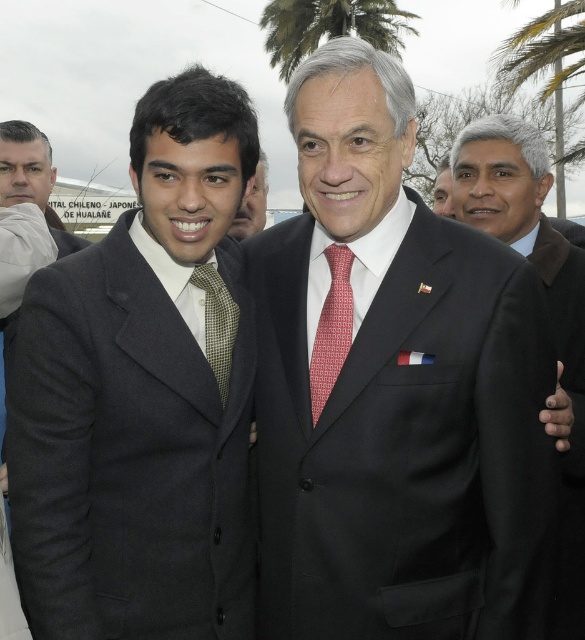
Based on the scene description, can you determine the spatial relationship between the dark gray suit at center and the green leafy palm tree at upper center?

The dark gray suit at center is located below the green leafy palm tree at upper center.

In the scene described, there are two men wearing a black matte suit at center and a green checkered tie at center. Based on their positions, which clothing item is positioned to the right of the other?

The black matte suit at center is positioned to the right of the green checkered tie at center.

You are a photographer adjusting the camera focus. The red woven tie at center and the matte black suit at center are both in the frame. Which object should you focus on first if you want to capture the one closer to the camera?

The red woven tie at center is not as tall as the matte black suit at center, so the red woven tie at center is closer to the camera. Focus on the red woven tie at center first.